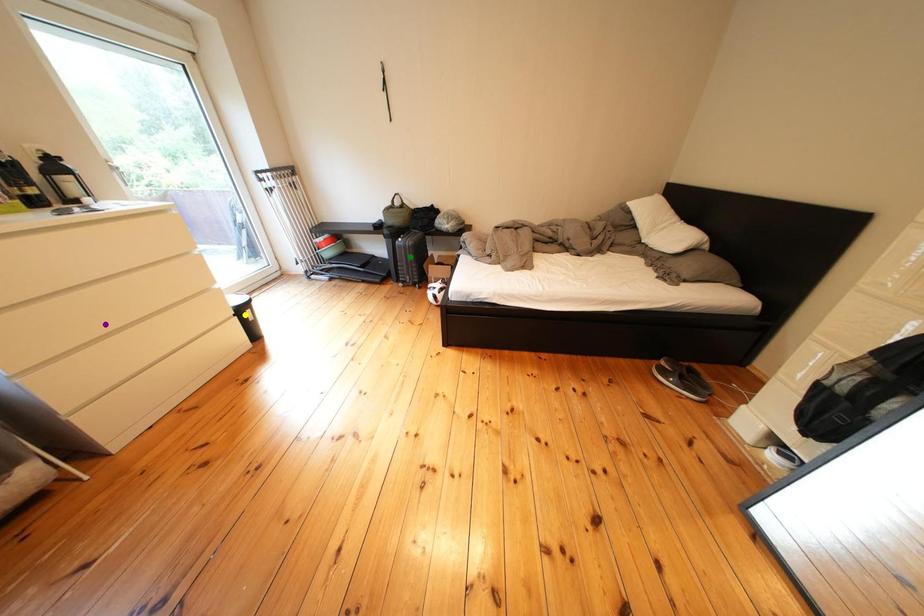
Order these from farthest to nearest:
A) green point
B) purple point
C) yellow point

green point
yellow point
purple point